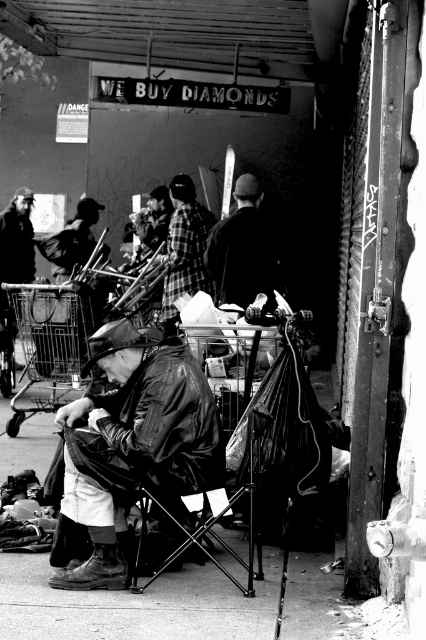
Question: Can you confirm if dark fabric jacket at center is positioned to the left of plaid fabric shirt at center?

Choices:
 (A) yes
 (B) no

Answer: (B)

Question: Which point is farther to the camera?

Choices:
 (A) leather jacket at center
 (B) leather-like folding chair at center
 (C) dark fabric jacket at center

Answer: (C)

Question: Is dark fabric jacket at center to the left of plaid fabric shirt at center from the viewer's perspective?

Choices:
 (A) no
 (B) yes

Answer: (A)

Question: Which is farther from the leather jacket at center?

Choices:
 (A) leather-like folding chair at center
 (B) plaid fabric shirt at center
 (C) dark fabric jacket at center

Answer: (B)

Question: Does dark fabric jacket at center appear under plaid fabric shirt at center?

Choices:
 (A) no
 (B) yes

Answer: (B)

Question: Which object appears farthest from the camera in this image?

Choices:
 (A) plaid fabric shirt at center
 (B) leather-like folding chair at center
 (C) dark fabric jacket at center

Answer: (A)